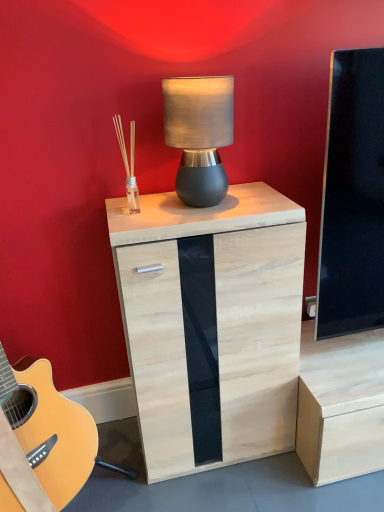
At what (x,y) coordinates should I click in order to perform the action: click on free space to the left of matte gray lamp at center. Please return your answer as a coordinate pair (x, y). The height and width of the screenshot is (512, 384). Looking at the image, I should click on (148, 204).